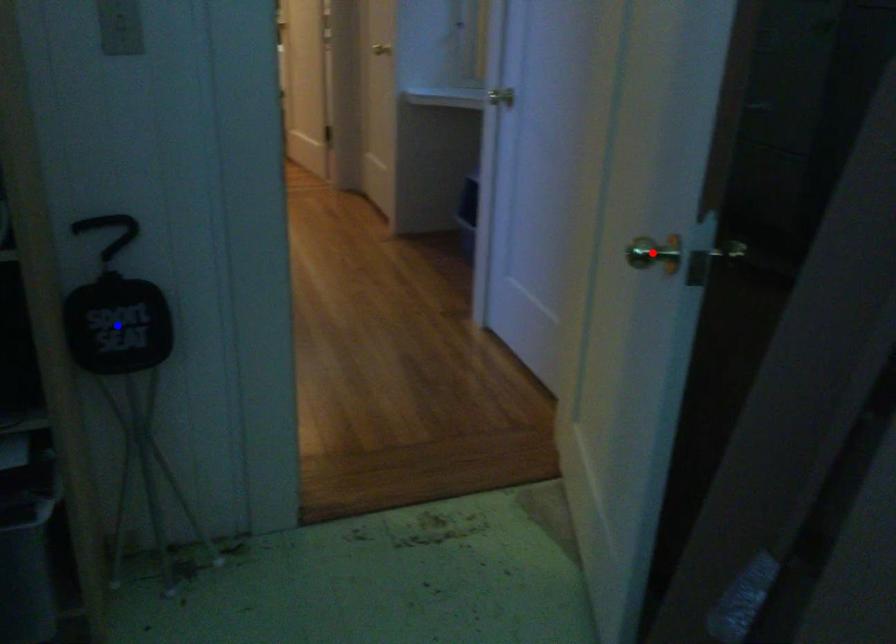
Question: Which of the two points in the image is closer to the camera?

Choices:
 (A) Blue point is closer.
 (B) Red point is closer.

Answer: (B)